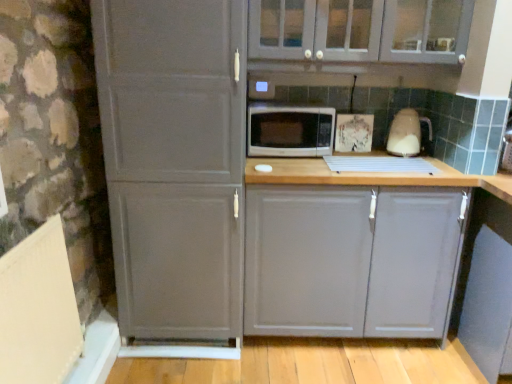
Question: Is white glossy kettle at right located within matte gray cabinet at center, the 1th cabinetry positioned from the bottom?

Choices:
 (A) yes
 (B) no

Answer: (B)

Question: Considering the relative sizes of matte gray cabinet at center, which is the 2th cabinetry from top to bottom, and white glossy kettle at right in the image provided, is matte gray cabinet at center, which is the 2th cabinetry from top to bottom, wider than white glossy kettle at right?

Choices:
 (A) yes
 (B) no

Answer: (A)

Question: Does matte gray cabinet at center, the 1th cabinetry positioned from the bottom, have a smaller size compared to white glossy kettle at right?

Choices:
 (A) no
 (B) yes

Answer: (A)

Question: Is matte gray cabinet at center, the 1th cabinetry positioned from the bottom, next to white glossy kettle at right and touching it?

Choices:
 (A) yes
 (B) no

Answer: (B)

Question: From the image's perspective, is matte gray cabinet at center, which is the 2th cabinetry from top to bottom, located above white glossy kettle at right?

Choices:
 (A) no
 (B) yes

Answer: (A)

Question: Is matte gray cabinet at center, the 1th cabinetry positioned from the bottom, completely or partially outside of white glossy kettle at right?

Choices:
 (A) no
 (B) yes

Answer: (B)

Question: Are white glossy kettle at right and matte gray cabinet at center, which is the 2th cabinetry from top to bottom, beside each other?

Choices:
 (A) yes
 (B) no

Answer: (B)

Question: Is matte gray cabinet at center, the 1th cabinetry positioned from the bottom, completely or partially inside white glossy kettle at right?

Choices:
 (A) no
 (B) yes

Answer: (A)

Question: Is white glossy kettle at right far away from matte gray cabinet at center, which is the 2th cabinetry from top to bottom?

Choices:
 (A) yes
 (B) no

Answer: (B)

Question: Is white glossy kettle at right positioned behind matte gray cabinet at center, the 1th cabinetry positioned from the bottom?

Choices:
 (A) no
 (B) yes

Answer: (B)

Question: Is white glossy kettle at right thinner than matte gray cabinet at center, the 1th cabinetry positioned from the bottom?

Choices:
 (A) yes
 (B) no

Answer: (A)

Question: Does white glossy kettle at right come in front of matte gray cabinet at center, the 1th cabinetry positioned from the bottom?

Choices:
 (A) yes
 (B) no

Answer: (B)

Question: Is white glossy kettle at right turned away from white glossy microwave at center?

Choices:
 (A) yes
 (B) no

Answer: (B)